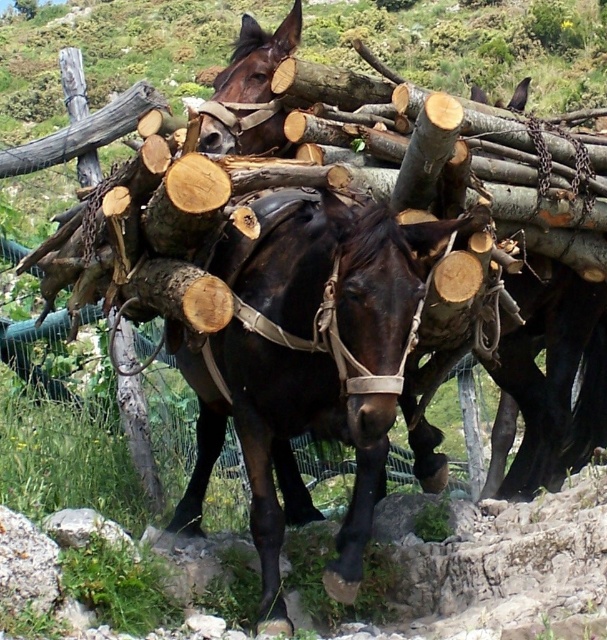
Who is lower down, brown leather harness at center or shiny brown horse at center?

shiny brown horse at center

You are a GUI agent. You are given a task and a screenshot of the screen. Output one action in this format:
    pyautogui.click(x=<x>, y=<y>)
    Task: Click on the brown leather harness at center
    This screenshot has height=640, width=607.
    Given the screenshot: What is the action you would take?
    click(476, 240)